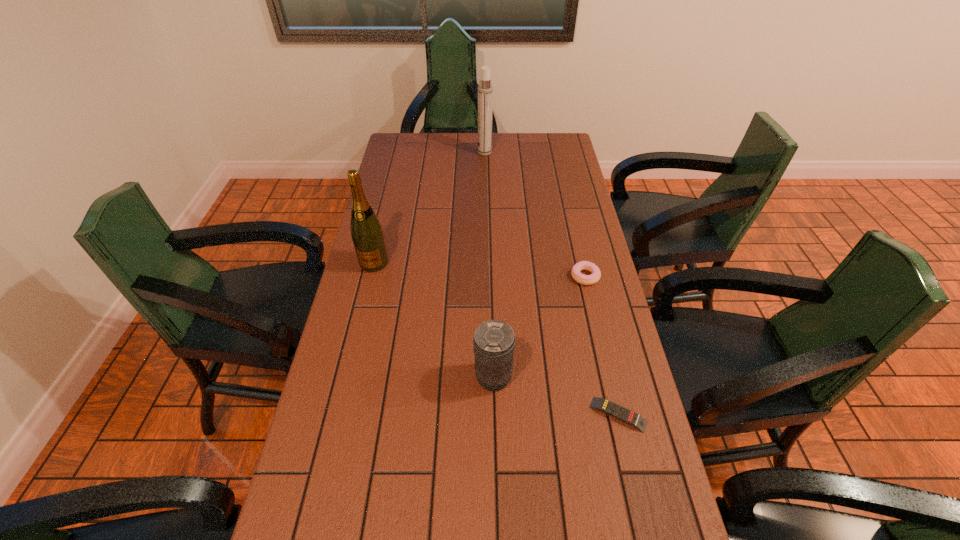
In order to click on the farthest object in this screenshot , I will do `click(485, 89)`.

Locate an element on the screen. The width and height of the screenshot is (960, 540). the leftmost object is located at coordinates (366, 231).

This screenshot has width=960, height=540. What are the coordinates of `the fourth farthest object` in the screenshot? It's located at (494, 341).

Where is `telephoto lens`? telephoto lens is located at coordinates (x=494, y=341).

Identify the location of the second shortest object. (583, 279).

You are a GUI agent. You are given a task and a screenshot of the screen. Output one action in this format:
    pyautogui.click(x=<x>, y=<y>)
    Task: Click on the remote control
    
    Given the screenshot: What is the action you would take?
    pyautogui.click(x=625, y=415)

You are a GUI agent. You are given a task and a screenshot of the screen. Output one action in this format:
    pyautogui.click(x=<x>, y=<y>)
    Task: Click on the nearest object
    The image size is (960, 540).
    Given the screenshot: What is the action you would take?
    625,415

The image size is (960, 540). I want to click on vacant space located 0.160m on the right of the aerosol can, so click(x=529, y=152).

I want to click on free space located on the front-facing side of the wine bottle, so click(357, 331).

This screenshot has height=540, width=960. In order to click on free point located on the side of the telephoto lens where the control switches are located in this screenshot , I will do `click(350, 377)`.